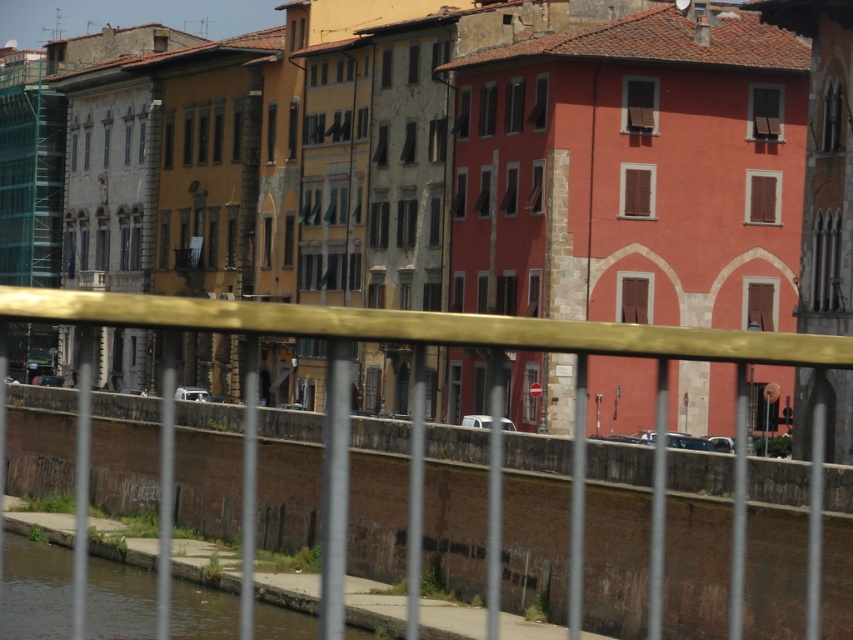
Is gold metallic fence at center to the right of brown concrete river at lower left from the viewer's perspective?

Yes, gold metallic fence at center is to the right of brown concrete river at lower left.

What do you see at coordinates (490, 412) in the screenshot? This screenshot has width=853, height=640. I see `gold metallic fence at center` at bounding box center [490, 412].

You are a GUI agent. You are given a task and a screenshot of the screen. Output one action in this format:
    pyautogui.click(x=<x>, y=<y>)
    Task: Click on the gold metallic fence at center
    This screenshot has height=640, width=853.
    Given the screenshot: What is the action you would take?
    pyautogui.click(x=490, y=412)